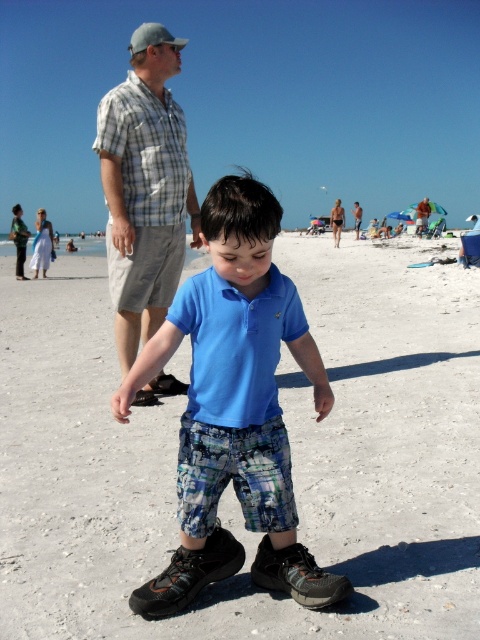
You are standing at the point labeled as point [144,195] in the beach scene. What object or person is located exactly at that point?

The point [144,195] corresponds to the plaid shirt at center.

You are a photographer trying to capture a photo of the beach scene. You notice the blue cotton shirt at center and the plaid cotton shirt at upper left. Which shirt should you focus on to ensure it appears larger in your photo?

The blue cotton shirt at center is much taller than the plaid cotton shirt at upper left, so focusing on the blue cotton shirt at center will make it appear larger in the photo.

You are standing at the point marked by coordinates point (235, 408) in the image. Looking around, you see a young boy in a bright blue polo shirt and an adult male in a light plaid shirt. Which direction should you walk to reach the blue cotton shirt at center?

The point marked by coordinates point (235, 408) is already at the location of the blue cotton shirt at center, so you are already there.